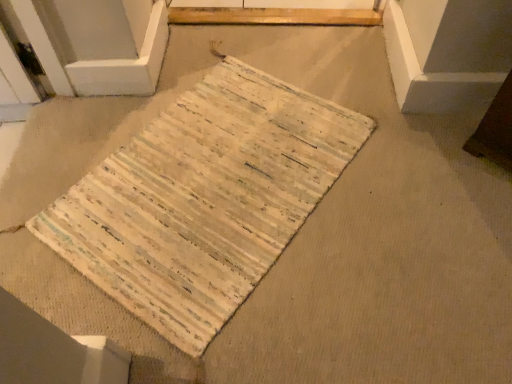
Describe the element at coordinates (203, 199) in the screenshot. I see `white woven mat at center` at that location.

Based on the photo, what is the approximate width of white woven mat at center?

white woven mat at center is 23.32 inches wide.

Image resolution: width=512 pixels, height=384 pixels. Find the location of `white woven mat at center`. white woven mat at center is located at coordinates click(x=203, y=199).

What is the approximate height of white woven mat at center?

A: white woven mat at center is 1.66 inches tall.

In order to click on white woven mat at center in this screenshot , I will do (x=203, y=199).